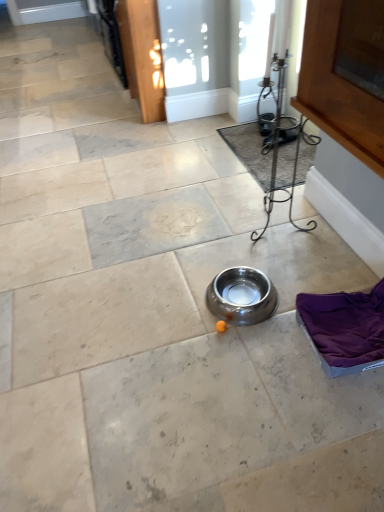
Measure the distance between silver metallic bowl at center and camera.

The depth of silver metallic bowl at center is 5.16 feet.

Describe the element at coordinates (241, 296) in the screenshot. The image size is (384, 512). I see `silver metallic bowl at center` at that location.

The width and height of the screenshot is (384, 512). What are the coordinates of `silver metallic bowl at center` in the screenshot? It's located at pyautogui.click(x=241, y=296).

Describe the element at coordinates (249, 150) in the screenshot. The width and height of the screenshot is (384, 512). I see `carpeted mat at center` at that location.

What is the approximate height of carpeted mat at center?

carpeted mat at center is 1.16 inches in height.

At what (x,y) coordinates should I click in order to perform the action: click on carpeted mat at center. Please return your answer as a coordinate pair (x, y). The height and width of the screenshot is (512, 384). Looking at the image, I should click on (249, 150).

I want to click on silver metallic bowl at center, so (x=241, y=296).

Considering the relative positions of carpeted mat at center and silver metallic bowl at center in the image provided, is carpeted mat at center to the right of silver metallic bowl at center from the viewer's perspective?

Yes.

Is carpeted mat at center positioned in front of silver metallic bowl at center?

No.

Does point (301, 179) appear closer or farther from the camera than point (248, 302)?

Point (301, 179) appears to be farther away from the viewer than point (248, 302).

From the image's perspective, is carpeted mat at center positioned above or below silver metallic bowl at center?

From the image's perspective, carpeted mat at center appears above silver metallic bowl at center.

From a real-world perspective, between carpeted mat at center and silver metallic bowl at center, who is vertically higher?

silver metallic bowl at center.

Which object is wider, carpeted mat at center or silver metallic bowl at center?

Wider between the two is carpeted mat at center.

Can you confirm if carpeted mat at center is taller than silver metallic bowl at center?

No, carpeted mat at center is not taller than silver metallic bowl at center.

Is carpeted mat at center bigger than silver metallic bowl at center?

Correct, carpeted mat at center is larger in size than silver metallic bowl at center.

Would you say silver metallic bowl at center is part of carpeted mat at center's contents?

Actually, silver metallic bowl at center is outside carpeted mat at center.

Is carpeted mat at center positioned far away from silver metallic bowl at center?

No, there isn't a large distance between carpeted mat at center and silver metallic bowl at center.

Does carpeted mat at center turn towards silver metallic bowl at center?

No, carpeted mat at center is not turned towards silver metallic bowl at center.

Can you tell me how much carpeted mat at center and silver metallic bowl at center differ in facing direction?

There is a 1.37-degree angle between the facing directions of carpeted mat at center and silver metallic bowl at center.

At what (x,y) coordinates should I click in order to perform the action: click on mat located on the right of silver metallic bowl at center. Please return your answer as a coordinate pair (x, y). Looking at the image, I should click on (249, 150).

Is silver metallic bowl at center at the left side of carpeted mat at center?

→ Yes, silver metallic bowl at center is to the left of carpeted mat at center.

Which object is closer to the camera taking this photo, silver metallic bowl at center or carpeted mat at center?

Positioned in front is silver metallic bowl at center.

Is point (243, 306) positioned before point (229, 133)?

Yes, point (243, 306) is closer to viewer.

From the image's perspective, which is below, silver metallic bowl at center or carpeted mat at center?

silver metallic bowl at center.

From a real-world perspective, is silver metallic bowl at center above or below carpeted mat at center?

In terms of real-world spatial position, silver metallic bowl at center is above carpeted mat at center.

Considering the relative sizes of silver metallic bowl at center and carpeted mat at center in the image provided, is silver metallic bowl at center thinner than carpeted mat at center?

Yes, silver metallic bowl at center is thinner than carpeted mat at center.

Which of these two, silver metallic bowl at center or carpeted mat at center, stands shorter?

carpeted mat at center.

Who is smaller, silver metallic bowl at center or carpeted mat at center?

With smaller size is silver metallic bowl at center.

Would you say silver metallic bowl at center is outside carpeted mat at center?

Yes, silver metallic bowl at center is located beyond the bounds of carpeted mat at center.

Is silver metallic bowl at center next to carpeted mat at center?

silver metallic bowl at center and carpeted mat at center are clearly separated.

Is silver metallic bowl at center turned away from carpeted mat at center?

No, silver metallic bowl at center's orientation is not away from carpeted mat at center.

How many degrees apart are the facing directions of silver metallic bowl at center and carpeted mat at center?

The angle between the facing direction of silver metallic bowl at center and the facing direction of carpeted mat at center is 1.37 degrees.

How much distance is there between silver metallic bowl at center and carpeted mat at center?

36.29 inches.

At what (x,y) coordinates should I click in order to perform the action: click on bowl below the carpeted mat at center (from the image's perspective). Please return your answer as a coordinate pair (x, y). Looking at the image, I should click on (241, 296).

Locate an element on the screen. This screenshot has height=512, width=384. mat behind the silver metallic bowl at center is located at coordinates (249, 150).

The height and width of the screenshot is (512, 384). I want to click on mat lying above the silver metallic bowl at center (from the image's perspective), so click(x=249, y=150).